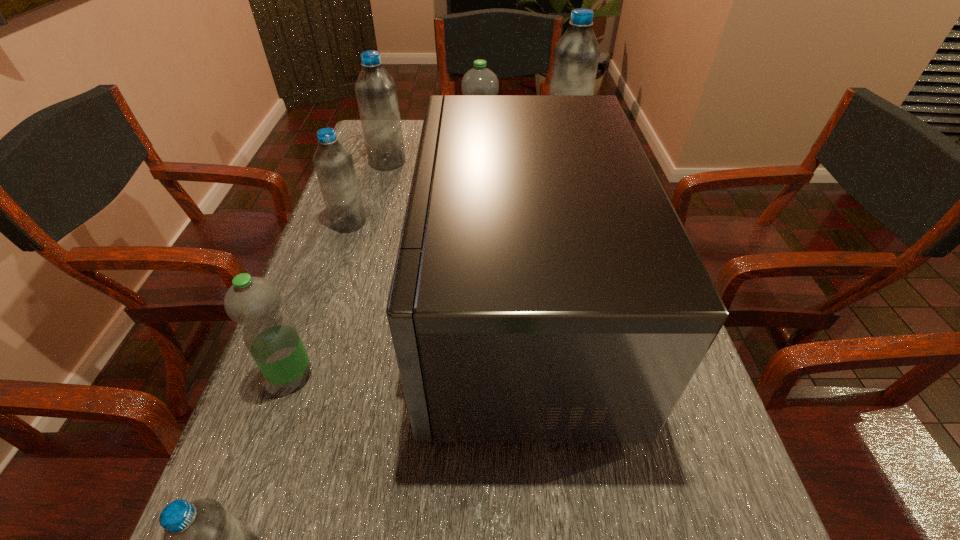
At what (x,y) coordinates should I click in order to perform the action: click on vacant space located on the left of the rightmost blue water bottle. Please return your answer as a coordinate pair (x, y). The image size is (960, 540). Looking at the image, I should click on (461, 140).

Identify the location of vacant space located on the front-facing side of the microwave oven. The width and height of the screenshot is (960, 540). (337, 314).

I want to click on vacant area situated 0.220m on the front-facing side of the microwave oven, so click(306, 314).

This screenshot has width=960, height=540. I want to click on free space located 0.140m on the front-facing side of the microwave oven, so click(x=347, y=314).

Identify the location of vacant space located on the front of the fifth water bottle from left to right. (480, 225).

In order to click on free spot located 0.080m on the back of the third smallest blue water bottle in this screenshot , I will do `click(394, 140)`.

Where is `vacant area situated on the right of the second smallest blue water bottle`? vacant area situated on the right of the second smallest blue water bottle is located at coordinates (423, 222).

This screenshot has height=540, width=960. Identify the location of free space located 0.210m on the right of the left green water bottle. (433, 375).

The width and height of the screenshot is (960, 540). What are the coordinates of `water bottle at the right edge` in the screenshot? It's located at (576, 55).

Where is `microwave oven at the right edge`? microwave oven at the right edge is located at coordinates (545, 290).